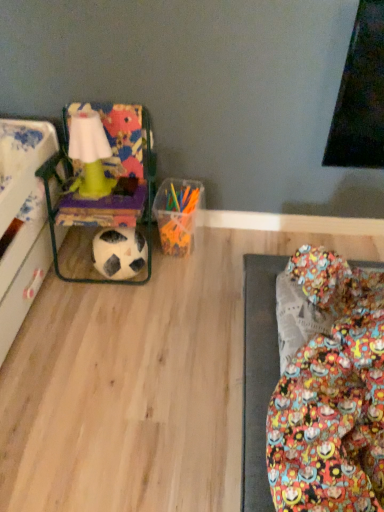
Identify the location of free space to the left of black matte football at lower left. (72, 277).